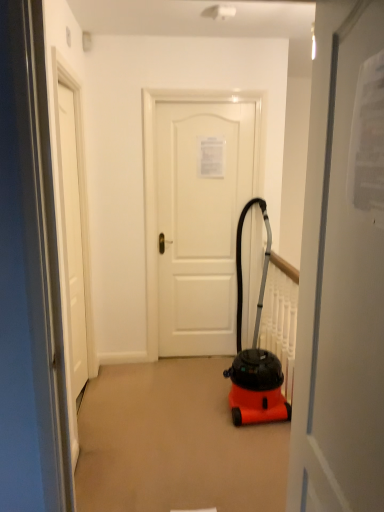
Question: Considering the positions of white matte door at center, the 2th door in the left-to-right sequence, and white matte door at center, arranged as the 1th door when viewed from the right, in the image, is white matte door at center, the 2th door in the left-to-right sequence, taller or shorter than white matte door at center, arranged as the 1th door when viewed from the right,?

Choices:
 (A) tall
 (B) short

Answer: (A)

Question: Considering the positions of white matte door at center, the 2th door in the left-to-right sequence, and white matte door at center, the 3th door viewed from the left, in the image, is white matte door at center, the 2th door in the left-to-right sequence, bigger or smaller than white matte door at center, the 3th door viewed from the left,?

Choices:
 (A) big
 (B) small

Answer: (B)

Question: Estimate the real-world distances between objects in this image. Which object is closer to the orange matte vacuum cleaner at center?

Choices:
 (A) white matte door at center, placed as the 2th door when sorted from front to back
 (B) white matte door at center, arranged as the 1th door when viewed from the right
 (C) white matte door at center, the 1th door when ordered from back to front

Answer: (C)

Question: Estimate the real-world distances between objects in this image. Which object is farther from the orange matte vacuum cleaner at center?

Choices:
 (A) white matte door at center, the 1th door when ordered from back to front
 (B) white matte door at center, the 3th door viewed from the left
 (C) white matte door at center, positioned as the second door in back-to-front order

Answer: (B)